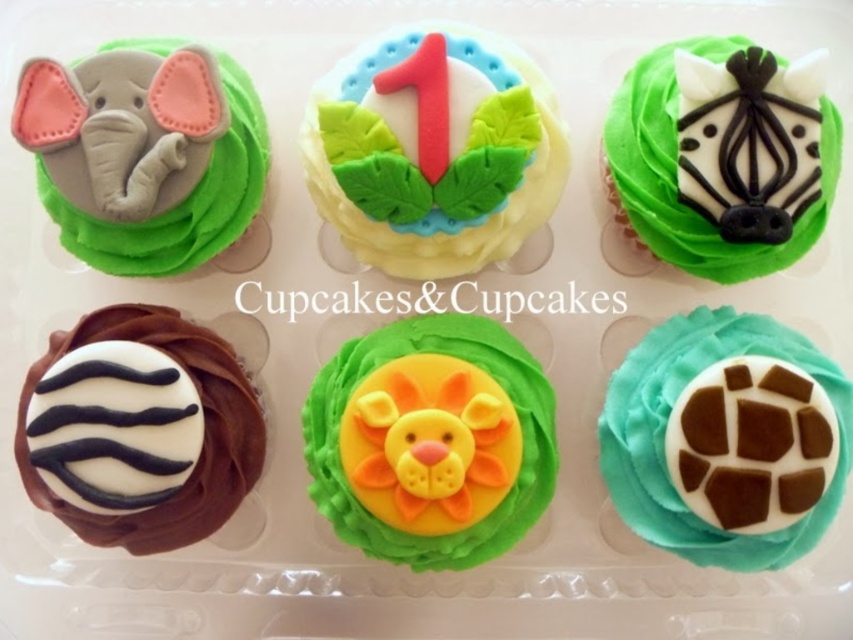
Question: Does yellow fondant lion at center have a greater width compared to white matte zebra print cupcake at bottom left?

Choices:
 (A) yes
 (B) no

Answer: (A)

Question: Estimate the real-world distances between objects in this image. Which object is closer to the yellow fondant lion at center?

Choices:
 (A) white matte zebra head at upper right
 (B) white matte zebra print cupcake at bottom left
 (C) teal matte giraffe print at bottom right
 (D) matte gray elephant at upper left

Answer: (B)

Question: Does matte gray elephant at upper left have a larger size compared to white matte zebra head at upper right?

Choices:
 (A) no
 (B) yes

Answer: (A)

Question: Which of these objects is positioned farthest from the yellow fondant cake with leaf decorations at center?

Choices:
 (A) teal matte giraffe print at bottom right
 (B) white matte zebra head at upper right

Answer: (A)

Question: Can you confirm if matte gray elephant at upper left is positioned to the right of white matte zebra print cupcake at bottom left?

Choices:
 (A) yes
 (B) no

Answer: (A)

Question: Which point is farther to the camera?

Choices:
 (A) yellow fondant cake with leaf decorations at center
 (B) white matte zebra head at upper right

Answer: (B)